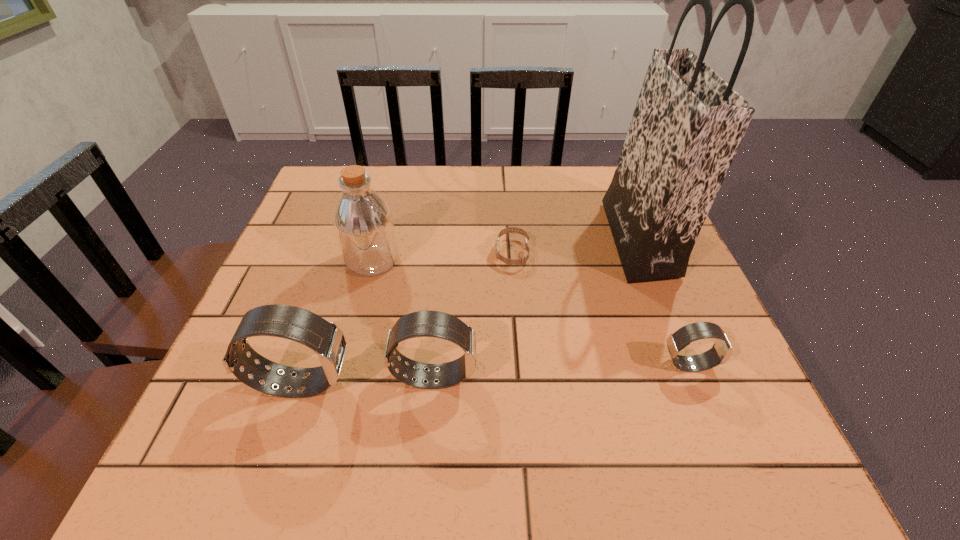
At what (x,y) coordinates should I click in order to perform the action: click on vacant spot for a new watch to ensure equal spacing. Please return your answer as a coordinate pair (x, y). This screenshot has width=960, height=540. Looking at the image, I should click on (564, 370).